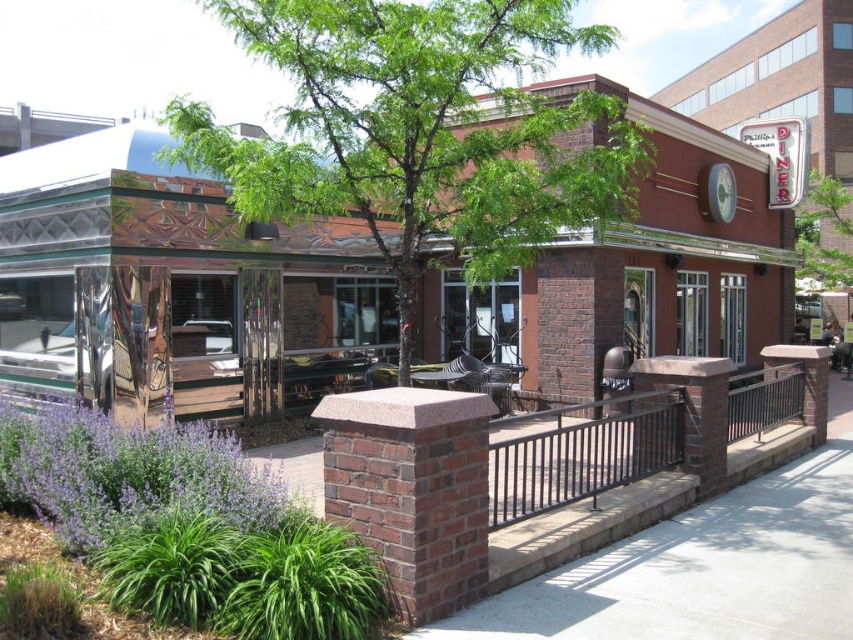
Question: Which object is the closest to the metallic silver table at center?

Choices:
 (A) brick diner at center
 (B) green leafy tree at center

Answer: (B)

Question: Is green leafy tree at center above smooth concrete pavement at center?

Choices:
 (A) no
 (B) yes

Answer: (B)

Question: Is brick diner at center wider than green leafy tree at upper center?

Choices:
 (A) yes
 (B) no

Answer: (A)

Question: Can you confirm if green leafy tree at center is bigger than green leafy tree at upper center?

Choices:
 (A) no
 (B) yes

Answer: (B)

Question: Which point is closer to the camera?

Choices:
 (A) (326, 196)
 (B) (833, 376)

Answer: (A)

Question: Which of the following is the farthest from the observer?

Choices:
 (A) smooth concrete pavement at center
 (B) green leafy tree at center
 (C) green leafy tree at upper center
 (D) metallic silver table at center

Answer: (C)